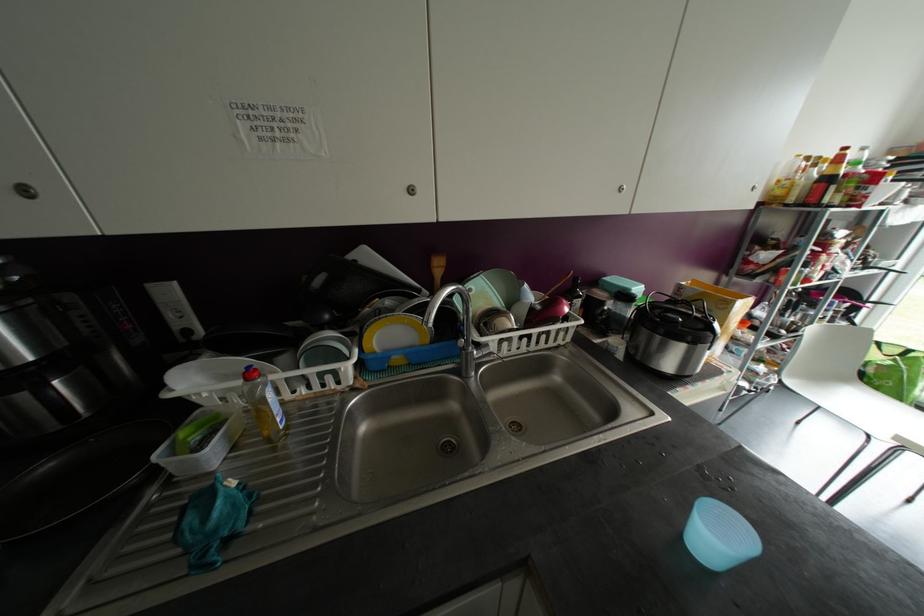
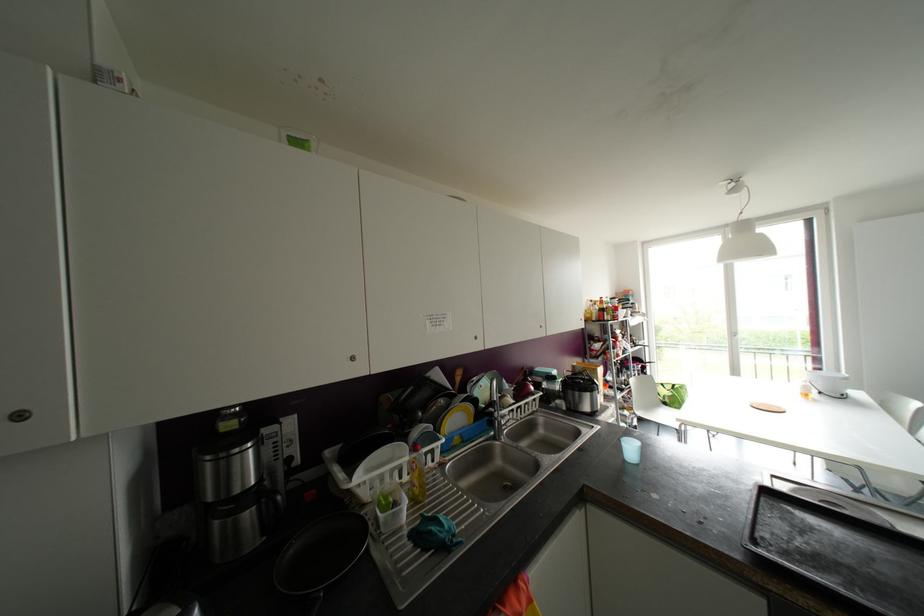
Find the pixel in the second image that matches point (27, 191) in the first image.

(351, 358)